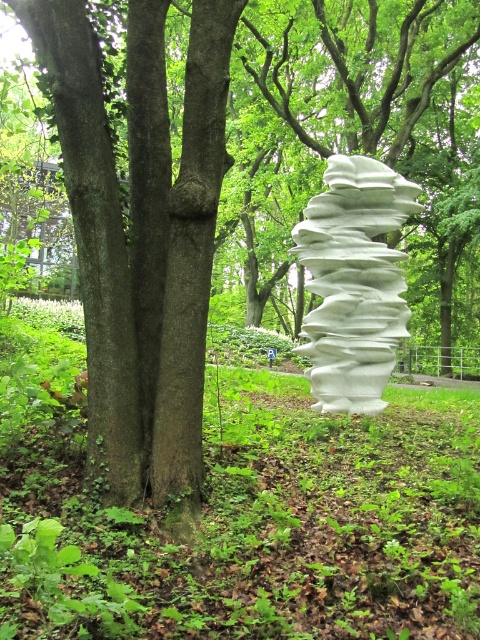
Question: Which point is farther from the camera taking this photo?

Choices:
 (A) (244, 454)
 (B) (396, 307)

Answer: (B)

Question: Is white matte sculpture at right below white matte sculpture at center?

Choices:
 (A) no
 (B) yes

Answer: (B)

Question: Which of the following is the closest to the observer?

Choices:
 (A) (347, 317)
 (B) (228, 634)

Answer: (B)

Question: Is white matte sculpture at right bigger than white matte sculpture at center?

Choices:
 (A) no
 (B) yes

Answer: (A)

Question: Is white matte sculpture at right below white matte sculpture at center?

Choices:
 (A) yes
 (B) no

Answer: (A)